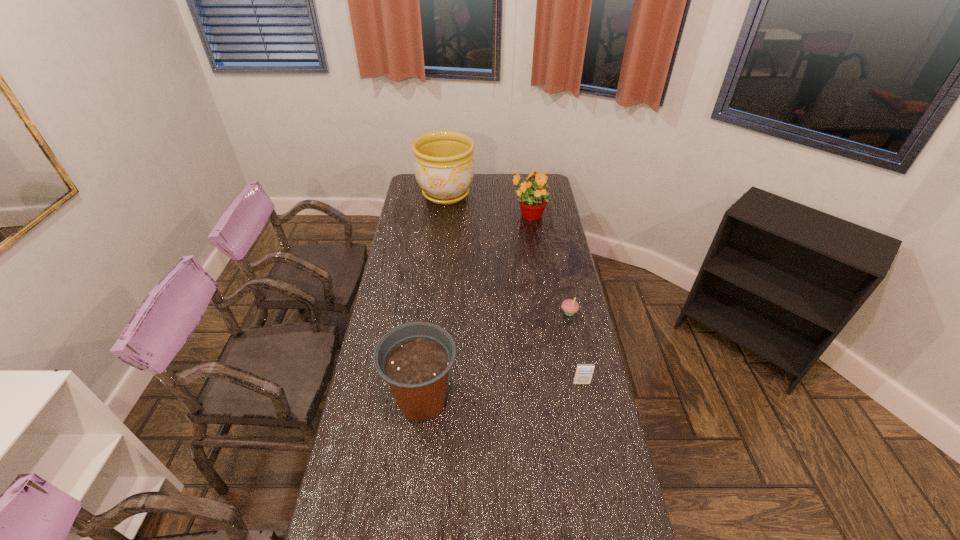
At what (x,y) coordinates should I click in order to perform the action: click on iPod that is at the right edge. Please return your answer as a coordinate pair (x, y). The image size is (960, 540). Looking at the image, I should click on (583, 374).

Locate an element on the screen. Image resolution: width=960 pixels, height=540 pixels. cupcake located at the right edge is located at coordinates (569, 306).

At what (x,y) coordinates should I click in order to perform the action: click on object located in the far left corner section of the desktop. Please return your answer as a coordinate pair (x, y). Looking at the image, I should click on (444, 168).

This screenshot has height=540, width=960. Identify the location of free space at the far edge. (489, 183).

In the image, there is a desktop. Where is `vacant space at the left edge`? This screenshot has width=960, height=540. vacant space at the left edge is located at coordinates (423, 287).

This screenshot has width=960, height=540. Identify the location of vacant space at the right edge. (545, 341).

Where is `empty space that is in between the nearest flowerpot and the cupcake`? empty space that is in between the nearest flowerpot and the cupcake is located at coordinates (495, 356).

The height and width of the screenshot is (540, 960). I want to click on free space between the rightmost flowerpot and the cupcake, so click(x=549, y=264).

Locate an element on the screen. This screenshot has height=540, width=960. unoccupied position between the rightmost flowerpot and the iPod is located at coordinates (555, 299).

At what (x,y) coordinates should I click in order to perform the action: click on vacant region between the iPod and the rightmost flowerpot. Please return your answer as a coordinate pair (x, y). This screenshot has height=540, width=960. Looking at the image, I should click on (555, 299).